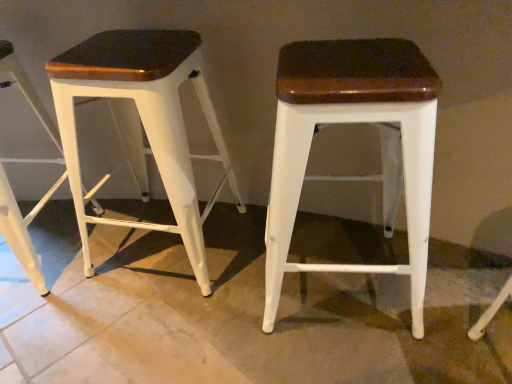
Where is `free spot above matte white stool at center, the third stool when ordered from left to right (from a real-world perspective)`? free spot above matte white stool at center, the third stool when ordered from left to right (from a real-world perspective) is located at coordinates (349, 60).